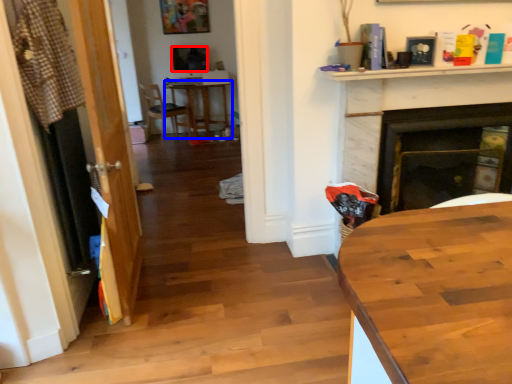
Question: Among these objects, which one is farthest to the camera, television (highlighted by a red box) or round table (highlighted by a blue box)?

Choices:
 (A) television
 (B) round table

Answer: (A)